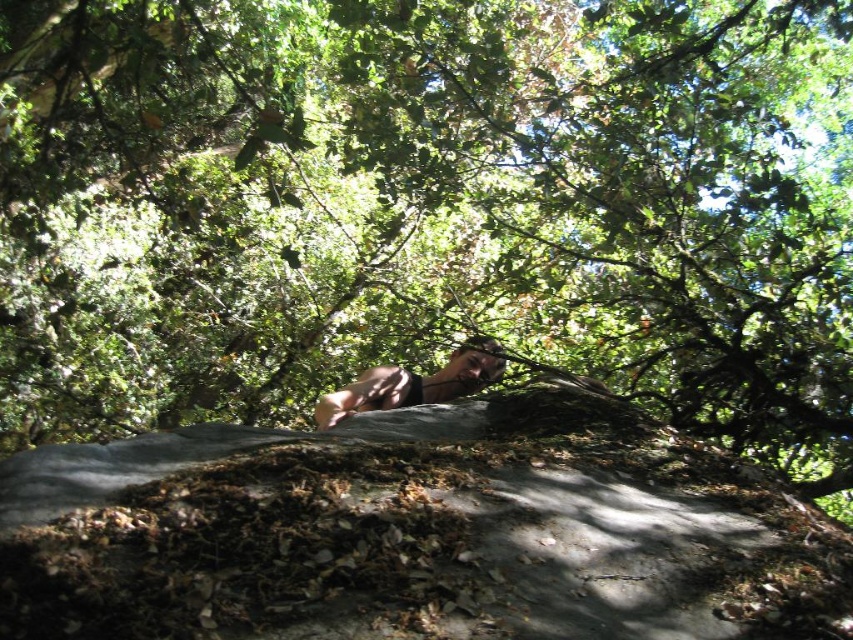
Which is below, gray rough boulder at center or brown leather belt at center?

gray rough boulder at center is below.

Which of these two, gray rough boulder at center or brown leather belt at center, stands taller?

With more height is brown leather belt at center.

Identify the location of gray rough boulder at center. The height and width of the screenshot is (640, 853). [416, 532].

Identify the location of gray rough boulder at center. (416, 532).